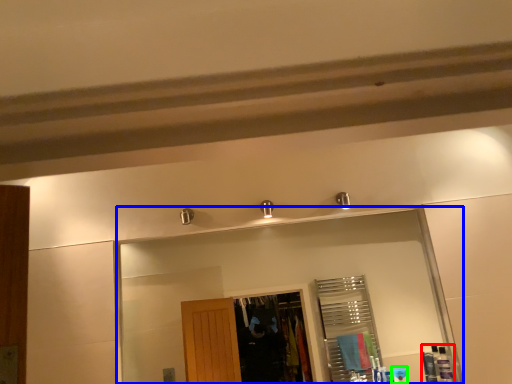
Question: Which is nearer to the toiletry (highlighted by a red box)? mirror (highlighted by a blue box) or toiletry (highlighted by a green box).

Choices:
 (A) mirror
 (B) toiletry

Answer: (B)